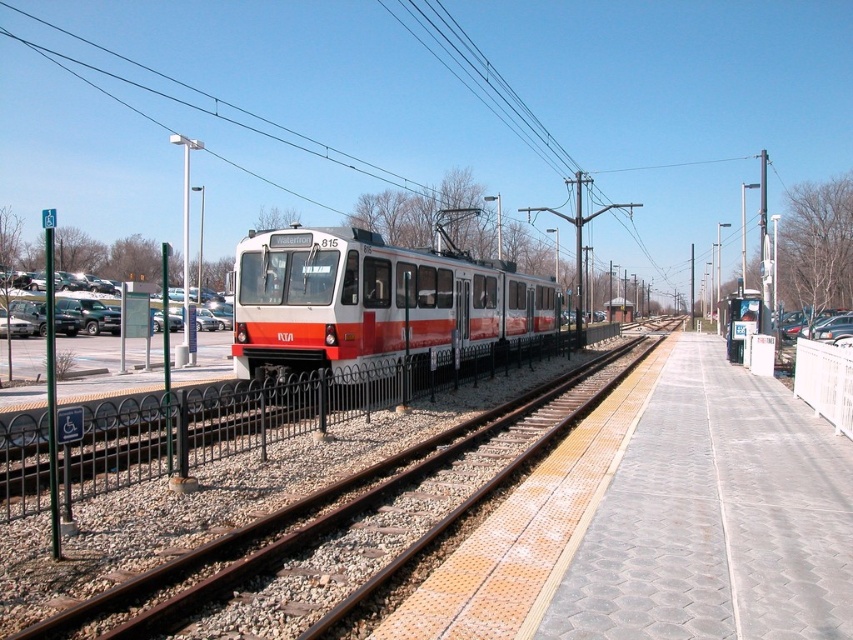
Which is behind, point (457, 518) or point (514, 298)?

The point (514, 298) is behind.

Does metal train track at center appear on the right side of white glossy train at center?

Correct, you'll find metal train track at center to the right of white glossy train at center.

At what (x,y) coordinates should I click in order to perform the action: click on metal train track at center. Please return your answer as a coordinate pair (x, y). Looking at the image, I should click on (346, 520).

Find the location of `metal train track at center`. metal train track at center is located at coordinates (346, 520).

Can you confirm if metal train track at center is thinner than metallic wire at upper center?

Indeed, metal train track at center has a lesser width compared to metallic wire at upper center.

Does metal train track at center have a greater width compared to metallic wire at upper center?

Incorrect, metal train track at center's width does not surpass metallic wire at upper center's.

Which is in front, point (471, 445) or point (447, 26)?

Positioned in front is point (471, 445).

Locate an element on the screen. This screenshot has width=853, height=640. metal train track at center is located at coordinates (346, 520).

Does white glossy train at center appear under metallic wire at upper center?

Yes.

Can you confirm if white glossy train at center is taller than metallic wire at upper center?

In fact, white glossy train at center may be shorter than metallic wire at upper center.

Between point (422, 273) and point (447, 19), which one is positioned in front?

Point (422, 273) is more forward.

You are a GUI agent. You are given a task and a screenshot of the screen. Output one action in this format:
    pyautogui.click(x=<x>, y=<y>)
    Task: Click on the white glossy train at center
    
    Given the screenshot: What is the action you would take?
    pyautogui.click(x=370, y=301)